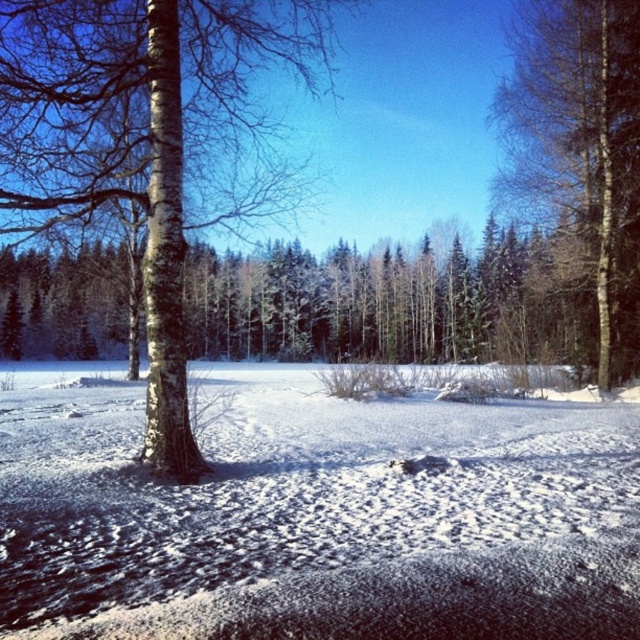
Does point (195, 477) come farther from viewer compared to point (608, 317)?

No, (195, 477) is closer to viewer.

Based on the photo, which is above, white bark tree at left or bark-like textured tree at right?

white bark tree at left is above.

I want to click on white bark tree at left, so click(x=150, y=141).

Identify the location of white bark tree at left. (150, 141).

Who is more forward, (65, 371) or (77, 124)?

Point (77, 124) is in front.

Is white fluffy snow at center positioned in front of white bark tree at left?

Yes, it is in front of white bark tree at left.

Which is in front, point (221, 400) or point (145, 276)?

Point (145, 276) is more forward.

Identify the location of white fluffy snow at center. This screenshot has width=640, height=640. (316, 516).

Which is behind, point (342, 625) or point (592, 232)?

Point (592, 232)

Does white fluffy snow at center appear over bark-like textured tree at right?

No, white fluffy snow at center is not above bark-like textured tree at right.

Identify the location of white fluffy snow at center. The height and width of the screenshot is (640, 640). (316, 516).